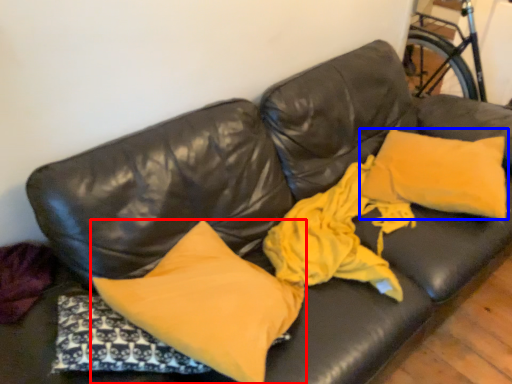
Question: Among these objects, which one is nearest to the camera, pillow (highlighted by a red box) or pillow (highlighted by a blue box)?

Choices:
 (A) pillow
 (B) pillow

Answer: (A)